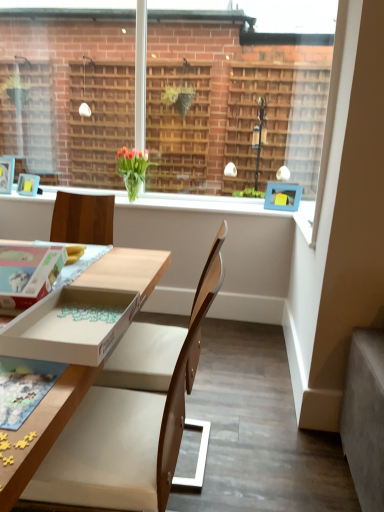
Question: Would you say wooden chair at center is inside or outside white cardboard box at lower left, arranged as the second box when viewed from the left?

Choices:
 (A) outside
 (B) inside

Answer: (A)

Question: Visually, is wooden chair at center positioned to the left or to the right of white cardboard box at lower left, the first box when ordered from right to left?

Choices:
 (A) left
 (B) right

Answer: (B)

Question: Which is nearer to the brick wall at upper center?

Choices:
 (A) wooden chair at center
 (B) translucent glass vase at upper center
 (C) cardboard box at lower left, placed as the 1th box when sorted from left to right
 (D) white cardboard box at lower left, the first box when ordered from right to left

Answer: (B)

Question: Which is nearer to the wooden chair at center?

Choices:
 (A) white cardboard box at lower left, the first box when ordered from right to left
 (B) brick wall at upper center
 (C) cardboard box at lower left, arranged as the 2th box when viewed from the right
 (D) translucent glass vase at upper center

Answer: (A)